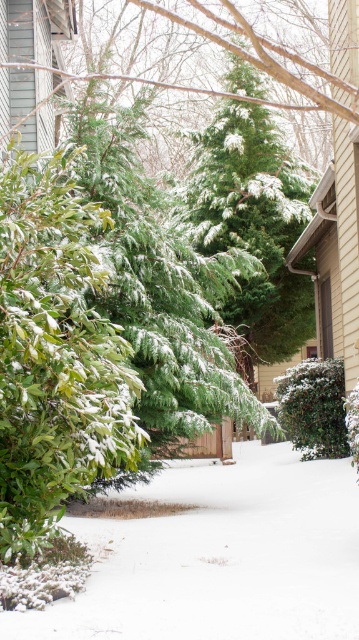
Question: Which point is farther to the camera?

Choices:
 (A) green matte bush at center
 (B) green matte bush at center-left

Answer: (A)

Question: Is green matte bush at center-left closer to camera compared to green matte evergreen tree at center?

Choices:
 (A) no
 (B) yes

Answer: (B)

Question: Which point appears closest to the camera in this image?

Choices:
 (A) (94, 612)
 (B) (314, 444)

Answer: (A)

Question: Is white fluffy snow at center positioned in front of green matte bush at center?

Choices:
 (A) no
 (B) yes

Answer: (B)

Question: Which of the following is the closest to the observer?

Choices:
 (A) green matte bush at center
 (B) green matte bush at center-left
 (C) white fluffy snow at center

Answer: (C)

Question: Is green matte bush at center-left smaller than green matte evergreen tree at center?

Choices:
 (A) no
 (B) yes

Answer: (B)